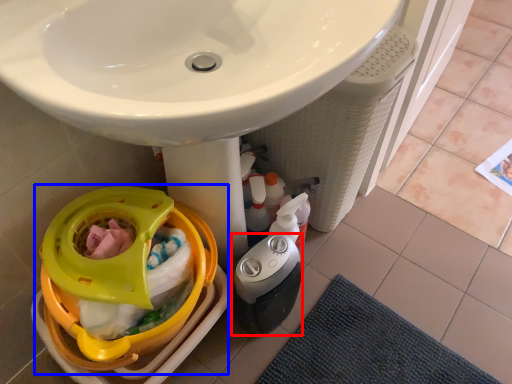
Question: Which object appears farthest to the camera in this image, appliance (highlighted by a red box) or baby carriage (highlighted by a blue box)?

Choices:
 (A) appliance
 (B) baby carriage

Answer: (A)